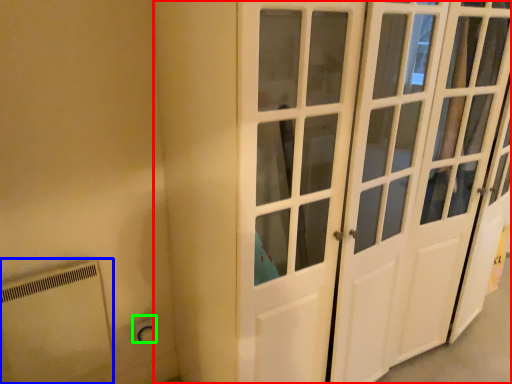
Question: Which is nearer to the door (highlighted by a red box)? appliance (highlighted by a blue box) or electric outlet (highlighted by a green box).

Choices:
 (A) appliance
 (B) electric outlet

Answer: (A)